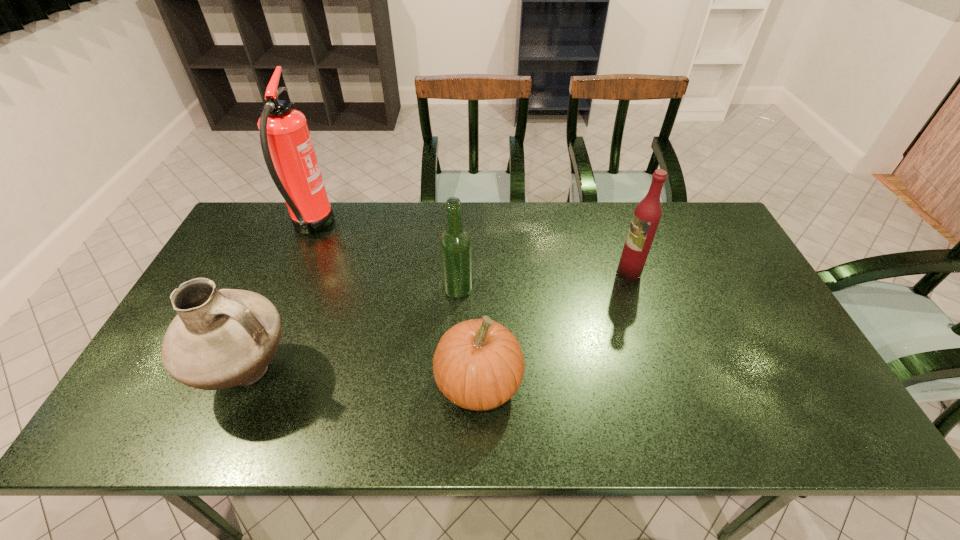
Locate an element on the screen. This screenshot has width=960, height=540. the farthest object is located at coordinates (288, 151).

Find the location of a particular element. This screenshot has height=540, width=960. the tallest object is located at coordinates (288, 151).

You are a GUI agent. You are given a task and a screenshot of the screen. Output one action in this format:
    pyautogui.click(x=<x>, y=<y>)
    Task: Click on the right liquor
    The width and height of the screenshot is (960, 540).
    Given the screenshot: What is the action you would take?
    pyautogui.click(x=646, y=217)

This screenshot has width=960, height=540. In order to click on the left liquor in this screenshot , I will do `click(455, 245)`.

Locate an element on the screen. The image size is (960, 540). pitcher is located at coordinates pos(222,338).

Where is `the shortest object`? The image size is (960, 540). the shortest object is located at coordinates (478, 364).

Where is `free space located at the nozzle of the fire extinguisher`? free space located at the nozzle of the fire extinguisher is located at coordinates (376, 227).

In order to click on vacant position located on the label of the right liquor in this screenshot , I will do `click(523, 273)`.

You are a GUI agent. You are given a task and a screenshot of the screen. Output one action in this format:
    pyautogui.click(x=<x>, y=<y>)
    Task: Click on the vacant space located 0.400m on the label of the right liquor
    The image size is (960, 540).
    Given the screenshot: What is the action you would take?
    pyautogui.click(x=483, y=273)

At what (x,y) coordinates should I click in order to perform the action: click on free space located 0.260m on the label of the right liquor. Please return your answer as a coordinate pair (x, y). This screenshot has height=540, width=960. Looking at the image, I should click on (530, 273).